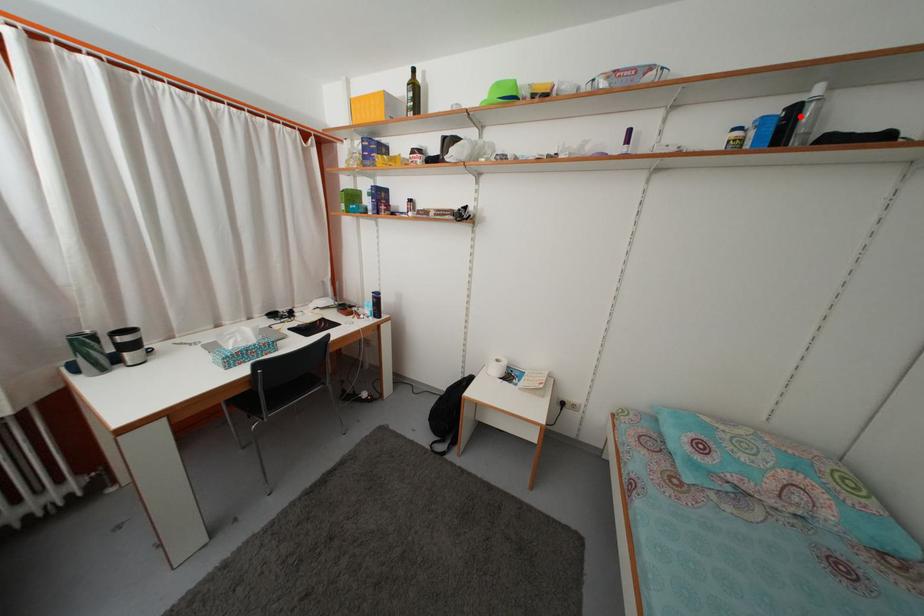
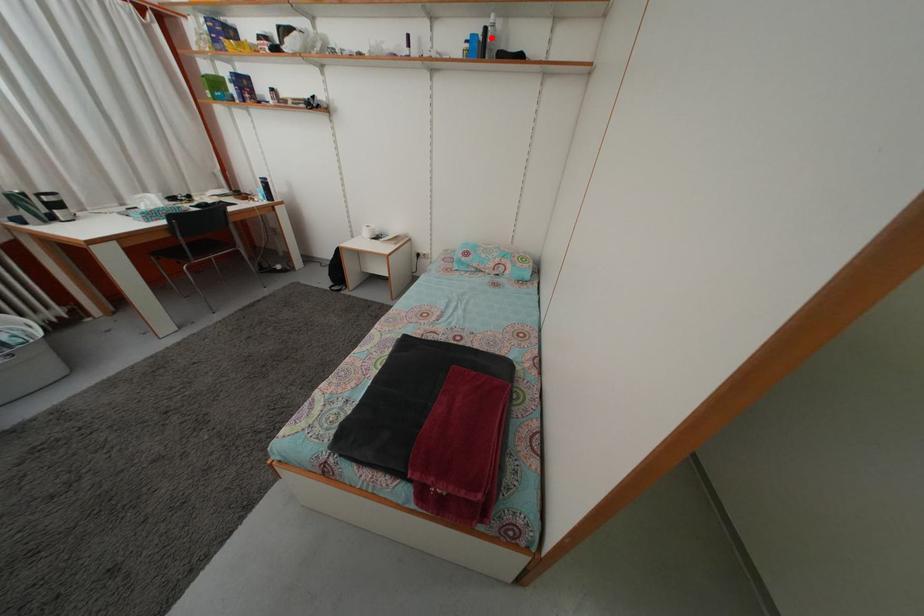
I am providing you with two images of the same scene from different viewpoints. A red point is marked on the first image and another point is marked on the second image. Do the highlighted points in image1 and image2 indicate the same real-world spot?

Yes